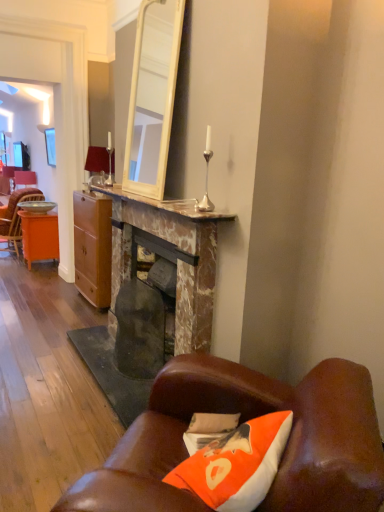
Question: Is leather couch at lower right not inside marble fireplace at center?

Choices:
 (A) yes
 (B) no

Answer: (A)

Question: Can you confirm if leather couch at lower right is shorter than marble fireplace at center?

Choices:
 (A) yes
 (B) no

Answer: (B)

Question: From the image's perspective, is leather couch at lower right on top of marble fireplace at center?

Choices:
 (A) no
 (B) yes

Answer: (A)

Question: Does leather couch at lower right appear on the left side of marble fireplace at center?

Choices:
 (A) no
 (B) yes

Answer: (A)

Question: From a real-world perspective, is leather couch at lower right located higher than marble fireplace at center?

Choices:
 (A) yes
 (B) no

Answer: (B)

Question: Looking at the image, does orange wood desk at left seem bigger or smaller compared to marble fireplace at center?

Choices:
 (A) small
 (B) big

Answer: (B)

Question: Considering the relative positions of orange wood desk at left and marble fireplace at center in the image provided, is orange wood desk at left to the left or to the right of marble fireplace at center?

Choices:
 (A) right
 (B) left

Answer: (B)

Question: From the image's perspective, relative to marble fireplace at center, is orange wood desk at left above or below?

Choices:
 (A) above
 (B) below

Answer: (A)

Question: Does point (24, 259) appear closer or farther from the camera than point (137, 308)?

Choices:
 (A) closer
 (B) farther

Answer: (B)

Question: From a real-world perspective, is matte silver lamp at upper left above or below matte wood cabinet at center?

Choices:
 (A) below
 (B) above

Answer: (B)

Question: From the image's perspective, relative to matte wood cabinet at center, is matte silver lamp at upper left above or below?

Choices:
 (A) below
 (B) above

Answer: (B)

Question: Considering the positions of matte silver lamp at upper left and matte wood cabinet at center in the image, is matte silver lamp at upper left taller or shorter than matte wood cabinet at center?

Choices:
 (A) short
 (B) tall

Answer: (A)

Question: Considering the positions of matte silver lamp at upper left and matte wood cabinet at center in the image, is matte silver lamp at upper left bigger or smaller than matte wood cabinet at center?

Choices:
 (A) small
 (B) big

Answer: (A)

Question: Considering their positions, is orange wood desk at left located in front of or behind marble fireplace at center?

Choices:
 (A) behind
 (B) front

Answer: (A)

Question: From a real-world perspective, relative to marble fireplace at center, is orange wood desk at left vertically above or below?

Choices:
 (A) below
 (B) above

Answer: (A)